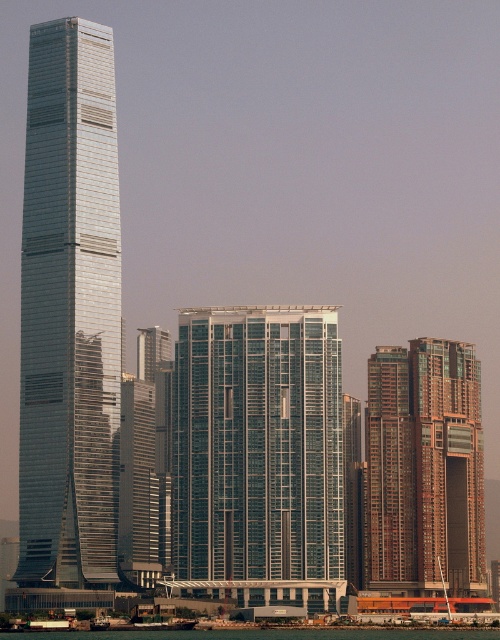
Question: Which of the following is the closest to the observer?

Choices:
 (A) brown glassy building at right
 (B) green water at lower center

Answer: (A)

Question: Can you confirm if brown glassy building at right is positioned above green water at lower center?

Choices:
 (A) yes
 (B) no

Answer: (A)

Question: Is brown glassy building at right to the left of green water at lower center from the viewer's perspective?

Choices:
 (A) no
 (B) yes

Answer: (A)

Question: Which of the following is the farthest from the observer?

Choices:
 (A) (477, 369)
 (B) (248, 509)
 (C) (364, 637)

Answer: (C)

Question: Can you confirm if shiny glass skyscraper at left is thinner than brown glassy building at right?

Choices:
 (A) yes
 (B) no

Answer: (A)

Question: Which of these objects is positioned closest to the shiny glass skyscraper at left?

Choices:
 (A) brown glassy building at right
 (B) green water at lower center

Answer: (B)